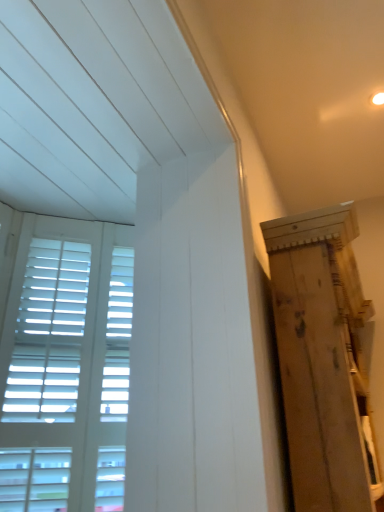
The width and height of the screenshot is (384, 512). What are the coordinates of `natural wood plywood at right` in the screenshot? It's located at (323, 358).

This screenshot has width=384, height=512. What do you see at coordinates (323, 358) in the screenshot? I see `natural wood plywood at right` at bounding box center [323, 358].

Identify the location of white wooden shutters at left. (66, 367).

What do you see at coordinates (66, 367) in the screenshot? This screenshot has width=384, height=512. I see `white wooden shutters at left` at bounding box center [66, 367].

The width and height of the screenshot is (384, 512). I want to click on natural wood plywood at right, so click(323, 358).

Is natural wood plywood at right to the left or to the right of white wooden shutters at left in the image?

natural wood plywood at right is to the right of white wooden shutters at left.

Is the depth of natural wood plywood at right less than that of white wooden shutters at left?

Yes, natural wood plywood at right is in front of white wooden shutters at left.

Does point (324, 240) lie behind point (4, 255)?

No, it is in front of (4, 255).

From the image's perspective, would you say natural wood plywood at right is positioned over white wooden shutters at left?

No, from the image's perspective, natural wood plywood at right is not on top of white wooden shutters at left.

From a real-world perspective, is natural wood plywood at right positioned over white wooden shutters at left based on gravity?

No, from a real-world perspective, natural wood plywood at right is not on top of white wooden shutters at left.

Which object is wider, natural wood plywood at right or white wooden shutters at left?

natural wood plywood at right is wider.

Who is shorter, natural wood plywood at right or white wooden shutters at left?

With less height is natural wood plywood at right.

Which of these two, natural wood plywood at right or white wooden shutters at left, is bigger?

natural wood plywood at right is bigger.

Is natural wood plywood at right inside the boundaries of white wooden shutters at left, or outside?

natural wood plywood at right is spatially situated outside white wooden shutters at left.

Can you see natural wood plywood at right touching white wooden shutters at left?

No.

Is white wooden shutters at left at the back of natural wood plywood at right?

Yes, natural wood plywood at right is facing away from white wooden shutters at left.

What's the angular difference between natural wood plywood at right and white wooden shutters at left's facing directions?

They differ by 44.2 degrees in their facing directions.

You are a GUI agent. You are given a task and a screenshot of the screen. Output one action in this format:
    pyautogui.click(x=<x>, y=<y>)
    Task: Click on the plywood that is under the white wooden shutters at left (from a real-world perspective)
    This screenshot has width=384, height=512.
    Given the screenshot: What is the action you would take?
    pyautogui.click(x=323, y=358)

Which object is positioned more to the left, white wooden shutters at left or natural wood plywood at right?

white wooden shutters at left.

Which is behind, white wooden shutters at left or natural wood plywood at right?

white wooden shutters at left is further away from the camera.

Does point (110, 430) appear closer or farther from the camera than point (299, 410)?

Point (110, 430) is positioned farther from the camera compared to point (299, 410).

From the image's perspective, is white wooden shutters at left located beneath natural wood plywood at right?

No, from the image's perspective, white wooden shutters at left is not below natural wood plywood at right.

Based on the photo, from a real-world perspective, is white wooden shutters at left physically located above or below natural wood plywood at right?

white wooden shutters at left is situated higher than natural wood plywood at right in the real world.

Is white wooden shutters at left wider or thinner than natural wood plywood at right?

Clearly, white wooden shutters at left has less width compared to natural wood plywood at right.

Can you confirm if white wooden shutters at left is taller than natural wood plywood at right?

Yes.

Who is bigger, white wooden shutters at left or natural wood plywood at right?

natural wood plywood at right is bigger.

From the picture: Is natural wood plywood at right surrounded by white wooden shutters at left?

No, natural wood plywood at right is not surrounded by white wooden shutters at left.

Is white wooden shutters at left not close to natural wood plywood at right?

white wooden shutters at left is near natural wood plywood at right, not far away.

Is white wooden shutters at left oriented away from natural wood plywood at right?

No, white wooden shutters at left is not facing away from natural wood plywood at right.

How many degrees apart are the facing directions of white wooden shutters at left and natural wood plywood at right?

The facing directions of white wooden shutters at left and natural wood plywood at right are 44.2 degrees apart.

I want to click on plywood in front of the white wooden shutters at left, so click(323, 358).

You are a GUI agent. You are given a task and a screenshot of the screen. Output one action in this format:
    pyautogui.click(x=<x>, y=<y>)
    Task: Click on the window lying on the left of natural wood plywood at right
    
    Given the screenshot: What is the action you would take?
    pyautogui.click(x=66, y=367)

This screenshot has height=512, width=384. There is a natural wood plywood at right. Find the location of `window above it (from a real-world perspective)`. window above it (from a real-world perspective) is located at coordinates (66, 367).